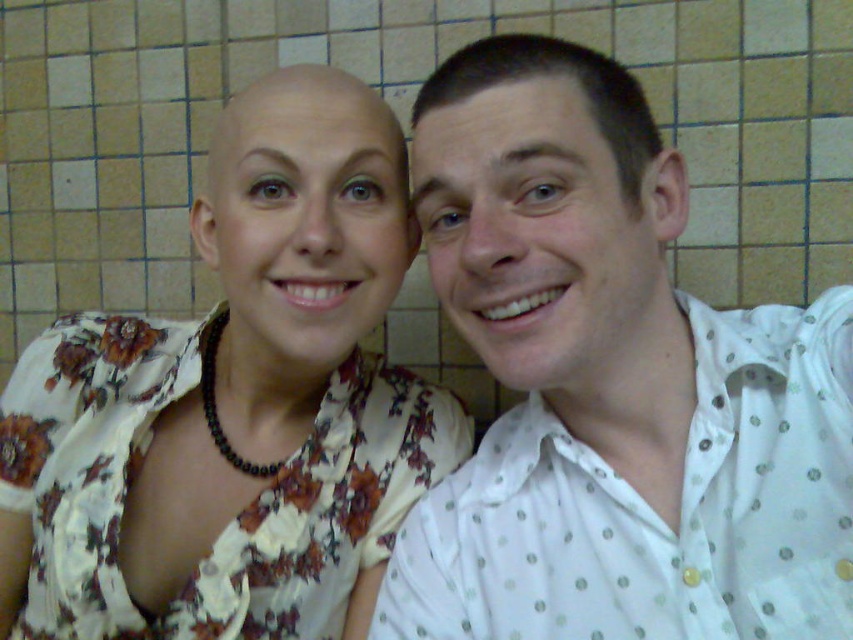
You are standing in front of the tiled wall background and want to place two markers at the coordinates point (20, 554) and point (155, 256). Which marker should you place first if you want to place them in the order from closest to farthest from your current position?

You should place the marker at point (155, 256) first because point (20, 554) is in front of point (155, 256), meaning it is closer to you. Therefore, the farther point (155, 256) should be placed first if you want to place them from closest to farthest.

You are standing in front of the photograph and want to determine which of the two points, point (444, 227) or point (28, 252), is nearer to you. Based on the scene description, which point is closer?

Point (444, 227) is closer to the viewer than point (28, 252).

You are a photographer trying to capture a closeup of the floral fabric dress at center and the beige tile at center in the background. Which object is positioned lower in the image?

The floral fabric dress at center is positioned below the beige tile at center, so it is lower in the image.